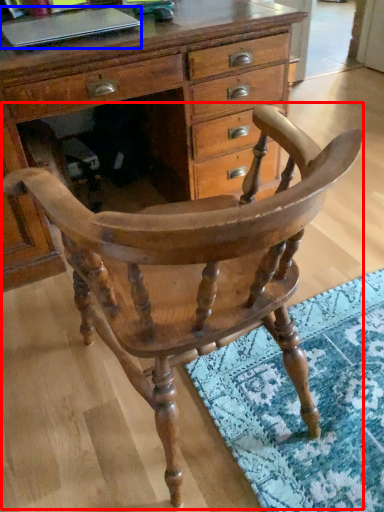
Question: Which of the following is the farthest to the observer, chair (highlighted by a red box) or laptop (highlighted by a blue box)?

Choices:
 (A) chair
 (B) laptop

Answer: (B)